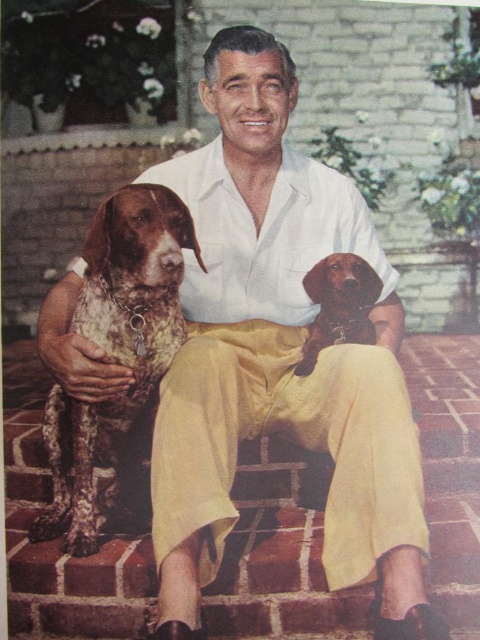
Does point (108, 288) come in front of point (337, 280)?

Yes, it is.

Is speckled fur dog at left to the right of smooth brown dachshund at center from the viewer's perspective?

No, speckled fur dog at left is not to the right of smooth brown dachshund at center.

Is point (96, 314) less distant than point (324, 333)?

Yes, point (96, 314) is in front of point (324, 333).

Where is `speckled fur dog at left`? speckled fur dog at left is located at coordinates (116, 348).